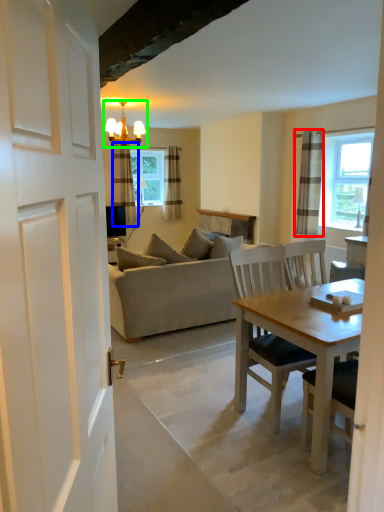
Question: Based on their relative distances, which object is nearer to curtain (highlighted by a red box)? Choose from curtain (highlighted by a blue box) and light fixture (highlighted by a green box).

Choices:
 (A) curtain
 (B) light fixture

Answer: (B)